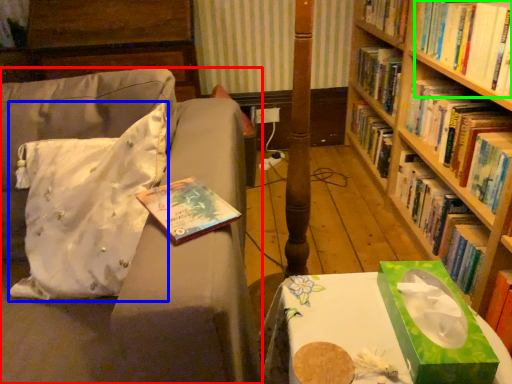
Question: Which object is positioned closest to studio couch (highlighted by a red box)? Select from throw pillow (highlighted by a blue box) and book (highlighted by a green box).

Choices:
 (A) throw pillow
 (B) book

Answer: (A)